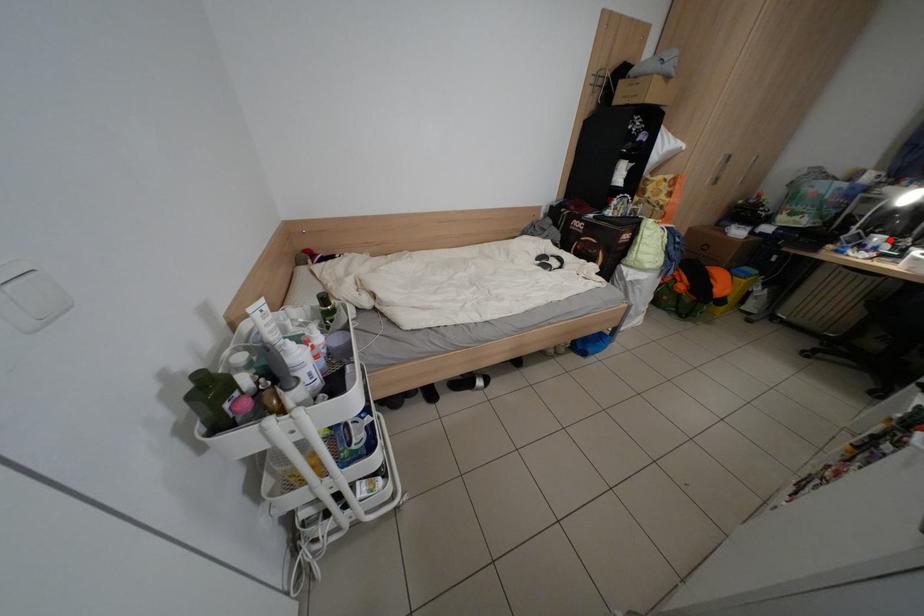
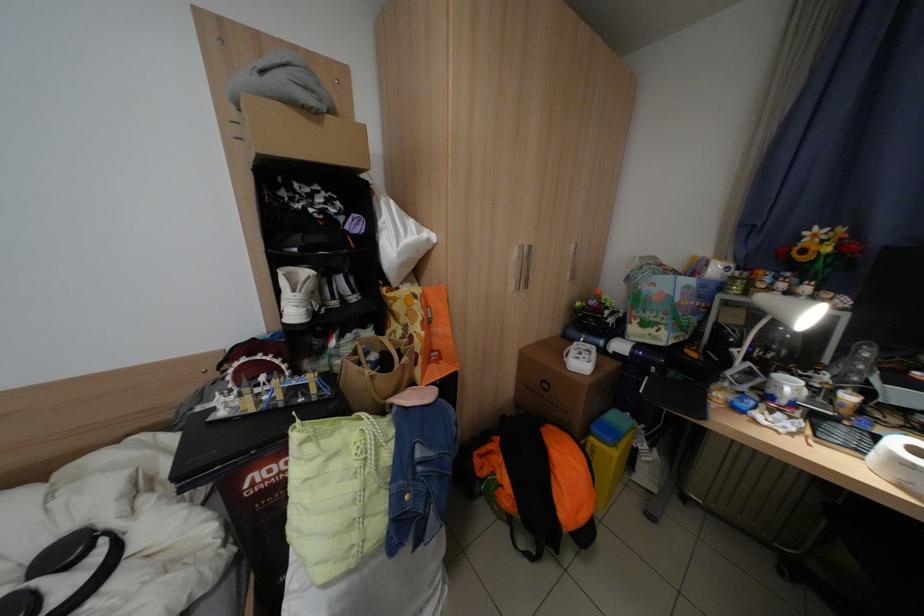
Find the pixel in the second image that matches the highlighted location in the first image.

(800, 387)